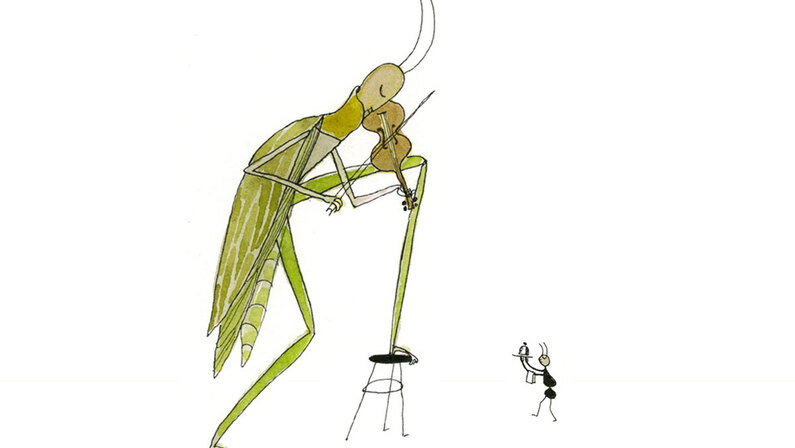
Where is `stool`? The height and width of the screenshot is (448, 795). stool is located at coordinates (386, 356).